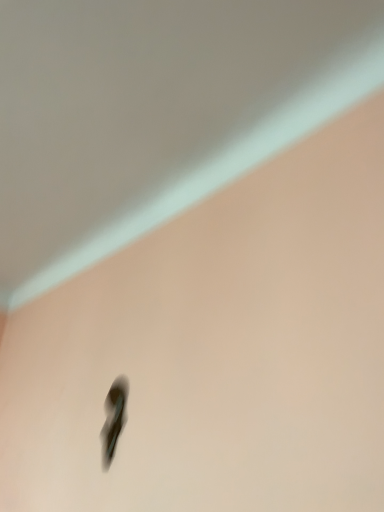
Measure the distance between matte white ceiling at upper center and camera.

matte white ceiling at upper center is 37.91 inches away from camera.

What do you see at coordinates (155, 112) in the screenshot? I see `matte white ceiling at upper center` at bounding box center [155, 112].

The height and width of the screenshot is (512, 384). I want to click on matte white ceiling at upper center, so click(x=155, y=112).

The image size is (384, 512). In order to click on matte black shoe at lower left in this screenshot , I will do `click(114, 417)`.

Describe the element at coordinates (114, 417) in the screenshot. I see `matte black shoe at lower left` at that location.

I want to click on matte white ceiling at upper center, so click(155, 112).

Considering the relative positions of matte white ceiling at upper center and matte black shoe at lower left in the image provided, is matte white ceiling at upper center to the left of matte black shoe at lower left from the viewer's perspective?

Yes.

Considering their positions, is matte white ceiling at upper center located in front of or behind matte black shoe at lower left?

matte white ceiling at upper center is in front of matte black shoe at lower left.

Which point is more forward, (x=212, y=104) or (x=127, y=397)?

The point (x=212, y=104) is closer to the camera.

From the image's perspective, which is above, matte white ceiling at upper center or matte black shoe at lower left?

matte white ceiling at upper center, from the image's perspective.

From a real-world perspective, is matte white ceiling at upper center positioned under matte black shoe at lower left based on gravity?

Incorrect, from a real-world perspective, matte white ceiling at upper center is higher than matte black shoe at lower left.

Is matte white ceiling at upper center thinner than matte black shoe at lower left?

No.

Considering the sizes of matte white ceiling at upper center and matte black shoe at lower left in the image, is matte white ceiling at upper center taller or shorter than matte black shoe at lower left?

In the image, matte white ceiling at upper center appears to be shorter than matte black shoe at lower left.

Considering the sizes of objects matte white ceiling at upper center and matte black shoe at lower left in the image provided, who is bigger, matte white ceiling at upper center or matte black shoe at lower left?

With larger size is matte white ceiling at upper center.

Do you think matte white ceiling at upper center is within matte black shoe at lower left, or outside of it?

matte white ceiling at upper center is outside matte black shoe at lower left.

Is matte white ceiling at upper center with matte black shoe at lower left?

No.

Is matte white ceiling at upper center positioned with its back to matte black shoe at lower left?

No, matte white ceiling at upper center is not facing the opposite direction of matte black shoe at lower left.

Can you tell me how much matte white ceiling at upper center and matte black shoe at lower left differ in facing direction?

There is a 1.1-degree angle between the facing directions of matte white ceiling at upper center and matte black shoe at lower left.

How far apart are matte white ceiling at upper center and matte black shoe at lower left?

matte white ceiling at upper center is 88.30 centimeters from matte black shoe at lower left.

Locate an element on the screen. This screenshot has width=384, height=512. backdrop positioned vertically above the matte black shoe at lower left (from a real-world perspective) is located at coordinates (155, 112).

Is matte black shoe at lower left to the left of matte white ceiling at upper center from the viewer's perspective?

In fact, matte black shoe at lower left is to the right of matte white ceiling at upper center.

Considering the positions of objects matte black shoe at lower left and matte white ceiling at upper center in the image provided, who is in front, matte black shoe at lower left or matte white ceiling at upper center?

matte white ceiling at upper center is more forward.

Considering the points (108, 401) and (168, 142), which point is behind, point (108, 401) or point (168, 142)?

The point (108, 401) is farther from the camera.

From the image's perspective, is matte black shoe at lower left under matte white ceiling at upper center?

Yes, from the image's perspective, matte black shoe at lower left is beneath matte white ceiling at upper center.

From a real-world perspective, is matte black shoe at lower left below matte white ceiling at upper center?

Correct, in the physical world, matte black shoe at lower left is lower than matte white ceiling at upper center.

Considering the sizes of objects matte black shoe at lower left and matte white ceiling at upper center in the image provided, who is thinner, matte black shoe at lower left or matte white ceiling at upper center?

Thinner between the two is matte black shoe at lower left.

Is matte black shoe at lower left taller than matte white ceiling at upper center?

Indeed, matte black shoe at lower left has a greater height compared to matte white ceiling at upper center.

Is matte black shoe at lower left smaller than matte white ceiling at upper center?

Yes.

Is matte white ceiling at upper center surrounded by matte black shoe at lower left?

That's incorrect, matte white ceiling at upper center is not inside matte black shoe at lower left.

Is matte black shoe at lower left far away from matte white ceiling at upper center?

No, matte black shoe at lower left is not far from matte white ceiling at upper center.

Is matte black shoe at lower left positioned with its back to matte white ceiling at upper center?

That's not correct — matte black shoe at lower left is not looking away from matte white ceiling at upper center.

Measure the distance from matte black shoe at lower left to matte white ceiling at upper center.

34.76 inches.

The image size is (384, 512). Find the location of `footwear that appears below the matte white ceiling at upper center (from a real-world perspective)`. footwear that appears below the matte white ceiling at upper center (from a real-world perspective) is located at coordinates pyautogui.click(x=114, y=417).

Image resolution: width=384 pixels, height=512 pixels. What are the coordinates of `backdrop in front of the matte black shoe at lower left` in the screenshot? It's located at (155, 112).

The image size is (384, 512). What are the coordinates of `footwear that appears behind the matte white ceiling at upper center` in the screenshot? It's located at (114, 417).